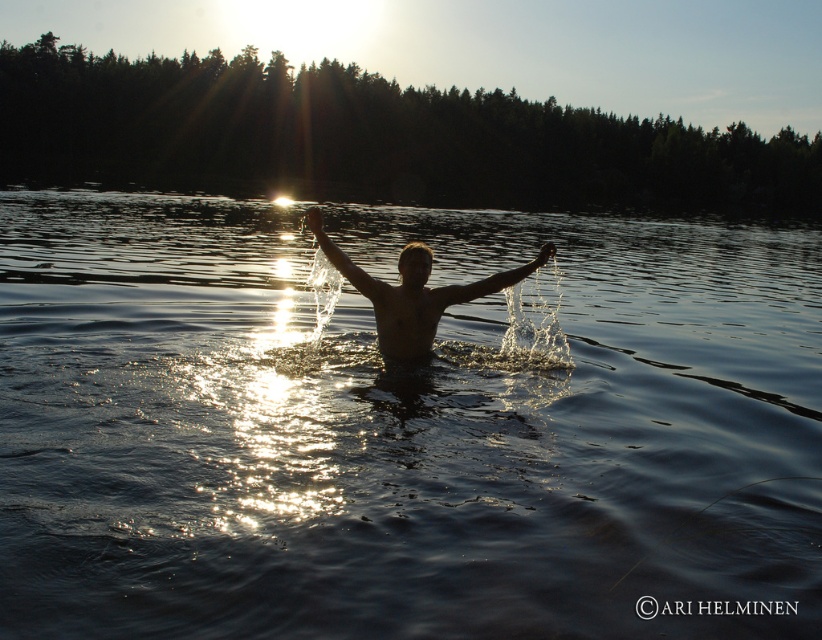
You are standing on the shore of the lake and see the dark liquid water at center and the silhouette skin person at center. Which object is closer to your left side?

The dark liquid water at center is closer to your left side because it is positioned to the left of the silhouette skin person at center.

You are standing on the shore of the lake and want to throw a small stone to hit the silhouette skin person at center without hitting the dark liquid water at center first. Is this possible?

The dark liquid water at center and silhouette skin person at center are 9.31 meters apart, so yes, you can throw the stone to hit the silhouette skin person at center without hitting the dark liquid water at center first as they are separated by a distance.